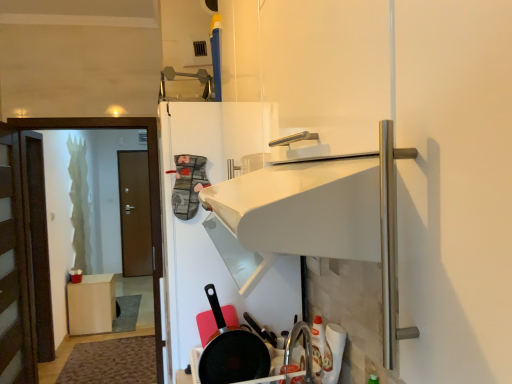
Question: In terms of size, does matte wood cabinet at lower left appear bigger or smaller than brown wooden door at left, which ranks as the 2th door in back-to-front order?

Choices:
 (A) small
 (B) big

Answer: (A)

Question: Looking at their shapes, would you say matte wood cabinet at lower left is wider or thinner than brown wooden door at left, the 1th door in the front-to-back sequence?

Choices:
 (A) thin
 (B) wide

Answer: (B)

Question: Estimate the real-world distances between objects in this image. Which object is farther from the non-stick black frying pan at lower center?

Choices:
 (A) brown wooden door at left, which ranks as the 2th door in back-to-front order
 (B) brown wooden door at left, the second door when ordered from front to back
 (C) matte brown screen door at left
 (D) matte wood cabinet at lower left

Answer: (B)

Question: Based on their relative distances, which object is nearer to the brown wooden door at left, the second door when ordered from front to back?

Choices:
 (A) matte brown screen door at left
 (B) brown wooden door at left, the 1th door in the front-to-back sequence
 (C) matte wood cabinet at lower left
 (D) non-stick black frying pan at lower center

Answer: (C)